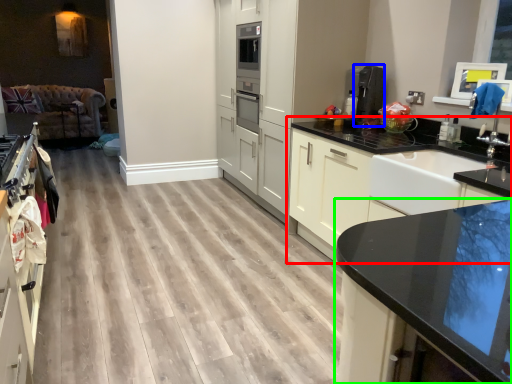
Question: Which is farther away from cabinetry (highlighted by a red box)? coffee machine (highlighted by a blue box) or countertop (highlighted by a green box)?

Choices:
 (A) coffee machine
 (B) countertop

Answer: (B)